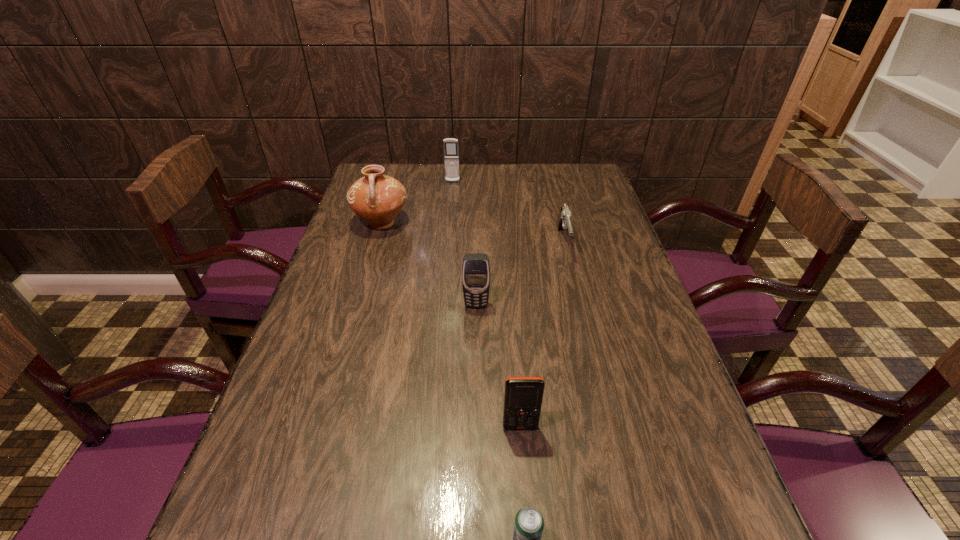
At what (x,y) coordinates should I click in order to perform the action: click on the leftmost object. Please return your answer as a coordinate pair (x, y). The height and width of the screenshot is (540, 960). Looking at the image, I should click on (376, 198).

This screenshot has width=960, height=540. What are the coordinates of `the fifth object from right to left` in the screenshot? It's located at (451, 154).

Find the location of a particular element. the farthest cellular telephone is located at coordinates (451, 154).

This screenshot has width=960, height=540. I want to click on the third object from left to right, so click(476, 268).

This screenshot has width=960, height=540. Find the location of `the second cellular telephone from left to right`. the second cellular telephone from left to right is located at coordinates (476, 268).

Image resolution: width=960 pixels, height=540 pixels. Find the location of `the rightmost cellular telephone`. the rightmost cellular telephone is located at coordinates (523, 396).

At what (x,y) coordinates should I click in order to perform the action: click on the fifth farthest object. Please return your answer as a coordinate pair (x, y). Image resolution: width=960 pixels, height=540 pixels. Looking at the image, I should click on (523, 396).

You are a GUI agent. You are given a task and a screenshot of the screen. Output one action in this format:
    pyautogui.click(x=<x>, y=<y>)
    Task: Click on the rightmost object
    This screenshot has height=540, width=960.
    Given the screenshot: What is the action you would take?
    pyautogui.click(x=563, y=222)

This screenshot has width=960, height=540. I want to click on vacant position located on the side of the leftmost object with the handle, so click(365, 279).

Locate an element on the screen. vacant space positioned 0.200m on the front-facing side of the farthest object is located at coordinates (449, 214).